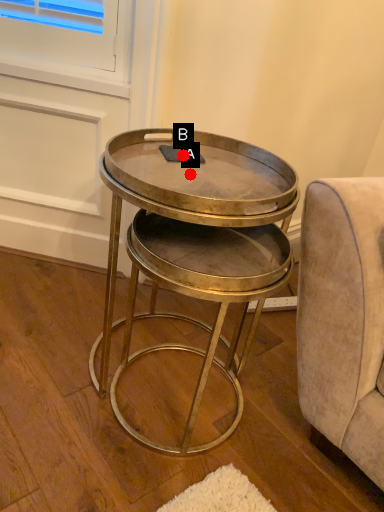
Question: Two points are circled on the image, labeled by A and B beside each circle. Which point is closer to the camera taking this photo?

Choices:
 (A) A is closer
 (B) B is closer

Answer: (A)